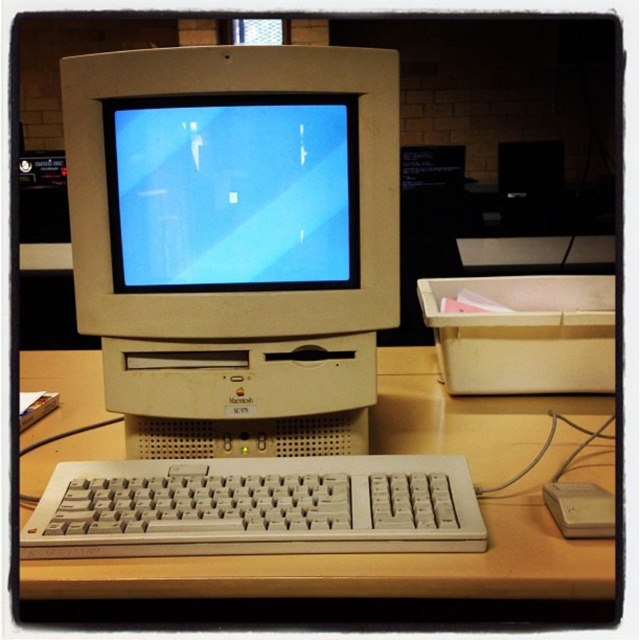
The image size is (640, 640). What do you see at coordinates (420, 560) in the screenshot?
I see `beige plastic keyboard at center` at bounding box center [420, 560].

Is beige plastic keyboard at center wider than beige plastic mouse at lower right?

Yes.

Locate an element on the screen. The image size is (640, 640). beige plastic keyboard at center is located at coordinates (420, 560).

The height and width of the screenshot is (640, 640). Find the location of `beige plastic keyboard at center`. beige plastic keyboard at center is located at coordinates (420, 560).

Is beige plastic keyboard at center below beige plastic keyboard at lower center?

No.

Who is shorter, beige plastic keyboard at center or beige plastic keyboard at lower center?

beige plastic keyboard at lower center

Does point (40, 465) lie behind point (122, 534)?

That is True.

The width and height of the screenshot is (640, 640). Identify the location of beige plastic keyboard at center. (420, 560).

Between beige plastic monitor at center and beige plastic keyboard at center, which one appears on the right side from the viewer's perspective?

Positioned to the right is beige plastic monitor at center.

Who is more forward, (129, 426) or (422, 355)?

Point (129, 426) is in front.

The image size is (640, 640). I want to click on beige plastic monitor at center, so click(236, 241).